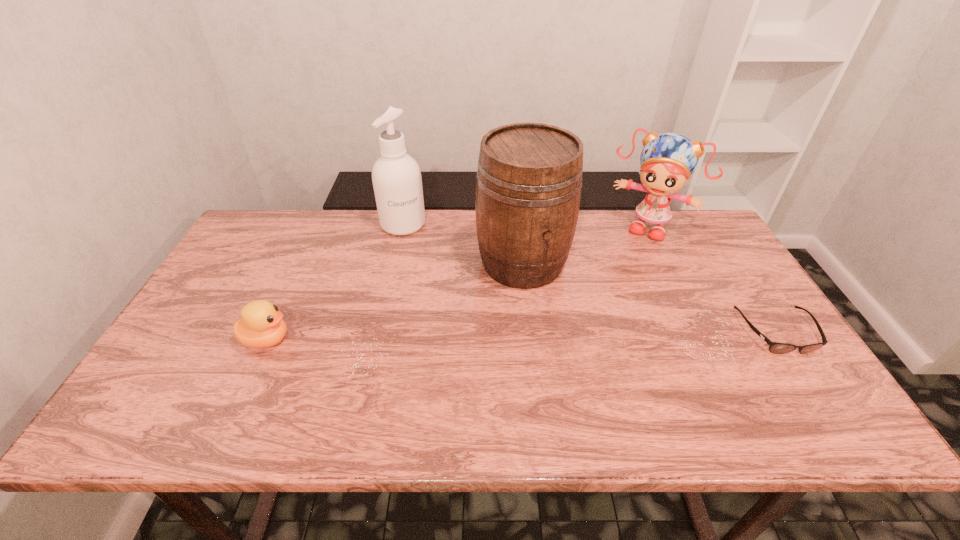
This screenshot has width=960, height=540. What are the coordinates of `doll located in the right edge section of the desktop` in the screenshot? It's located at (667, 160).

Find the location of `object that is at the far right corner`. object that is at the far right corner is located at coordinates (667, 160).

Locate an element on the screen. This screenshot has height=540, width=960. blank space at the far edge is located at coordinates (595, 240).

Identify the location of vacant point at the near edge. The width and height of the screenshot is (960, 540). (404, 387).

Find the location of a particular element. This screenshot has height=540, width=960. vacant space at the right edge is located at coordinates (728, 340).

Locate an element on the screen. Image resolution: width=960 pixels, height=540 pixels. free space at the far left corner is located at coordinates (273, 243).

You are a GUI agent. You are given a task and a screenshot of the screen. Output one action in this format:
    pyautogui.click(x=<x>, y=<y>)
    Task: Click on the free space at the far right corner
    This screenshot has height=540, width=960.
    Given the screenshot: What is the action you would take?
    pyautogui.click(x=664, y=227)

Locate an element on the screen. Image resolution: width=960 pixels, height=540 pixels. vacant space at the near right corner of the desktop is located at coordinates (777, 369).

You are a GUI agent. You are given a task and a screenshot of the screen. Output one action in this format:
    pyautogui.click(x=<x>, y=<y>)
    Task: Click on the empty space between the duckling and the third shortest object
    This screenshot has height=540, width=960.
    Given the screenshot: What is the action you would take?
    pyautogui.click(x=458, y=284)

Where is `vacant area that lies between the sunglasses and the fourth object from right to left`? vacant area that lies between the sunglasses and the fourth object from right to left is located at coordinates (590, 278).